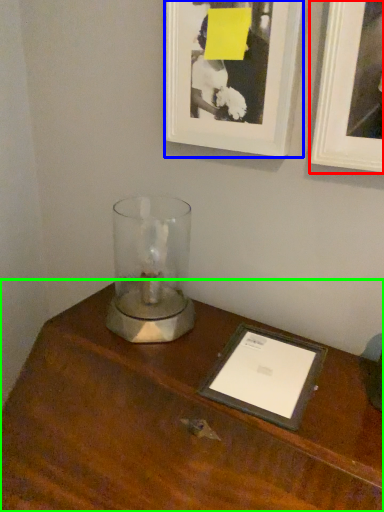
Question: Which object is positioned farthest from picture frame (highlighted by a red box)? Select from picture frame (highlighted by a blue box) and table (highlighted by a green box).

Choices:
 (A) picture frame
 (B) table

Answer: (B)